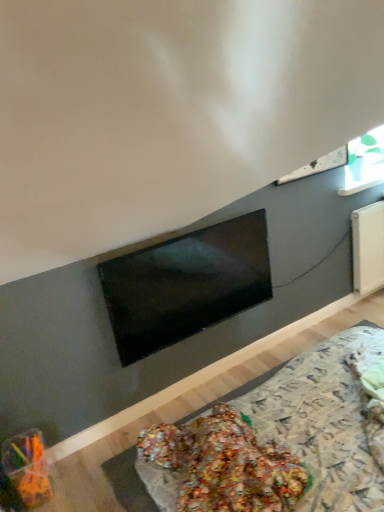
Question: Is transparent glass window at upper right at the back of translucent plastic container at lower left?

Choices:
 (A) yes
 (B) no

Answer: (B)

Question: Is translucent plastic container at lower left outside transparent glass window at upper right?

Choices:
 (A) yes
 (B) no

Answer: (A)

Question: Can you confirm if translucent plastic container at lower left is taller than transparent glass window at upper right?

Choices:
 (A) yes
 (B) no

Answer: (B)

Question: From the image's perspective, is translucent plastic container at lower left on transparent glass window at upper right?

Choices:
 (A) yes
 (B) no

Answer: (B)

Question: Is translucent plastic container at lower left far from transparent glass window at upper right?

Choices:
 (A) no
 (B) yes

Answer: (B)

Question: In terms of height, does translucent plastic container at lower left look taller or shorter compared to transparent glass window at upper right?

Choices:
 (A) tall
 (B) short

Answer: (B)

Question: Relative to transparent glass window at upper right, is translucent plastic container at lower left in front or behind?

Choices:
 (A) front
 (B) behind

Answer: (A)

Question: Is translucent plastic container at lower left wider or thinner than transparent glass window at upper right?

Choices:
 (A) wide
 (B) thin

Answer: (A)

Question: Is point (46, 481) positioned closer to the camera than point (364, 147)?

Choices:
 (A) closer
 (B) farther

Answer: (A)

Question: Is point (362, 139) positioned closer to the camera than point (48, 496)?

Choices:
 (A) closer
 (B) farther

Answer: (B)

Question: From a real-world perspective, is transparent glass window at upper right positioned above or below translucent plastic container at lower left?

Choices:
 (A) above
 (B) below

Answer: (A)

Question: From the image's perspective, is transparent glass window at upper right located above or below translucent plastic container at lower left?

Choices:
 (A) below
 (B) above

Answer: (B)

Question: Visually, is transparent glass window at upper right positioned to the left or to the right of translucent plastic container at lower left?

Choices:
 (A) left
 (B) right

Answer: (B)

Question: Considering the positions of point (28, 473) and point (129, 280), is point (28, 473) closer or farther from the camera than point (129, 280)?

Choices:
 (A) farther
 (B) closer

Answer: (B)

Question: Is translucent plastic container at lower left spatially inside matte black tv at center, or outside of it?

Choices:
 (A) outside
 (B) inside

Answer: (A)